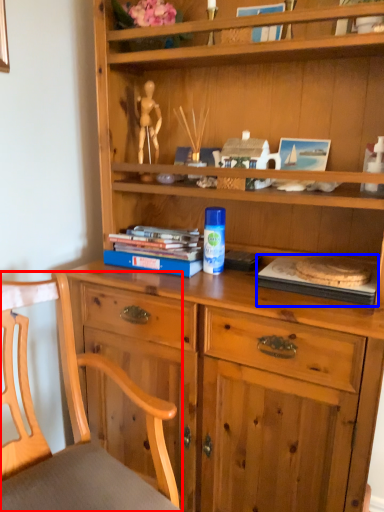
Question: Which of the following is the closest to the observer, chair (highlighted by a red box) or paperback book (highlighted by a blue box)?

Choices:
 (A) chair
 (B) paperback book

Answer: (A)